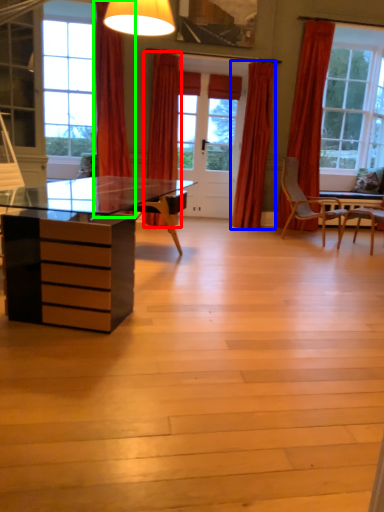
Question: Which object is the farthest from curtain (highlighted by a red box)? Choose among these: curtain (highlighted by a blue box) or curtain (highlighted by a green box).

Choices:
 (A) curtain
 (B) curtain

Answer: (A)